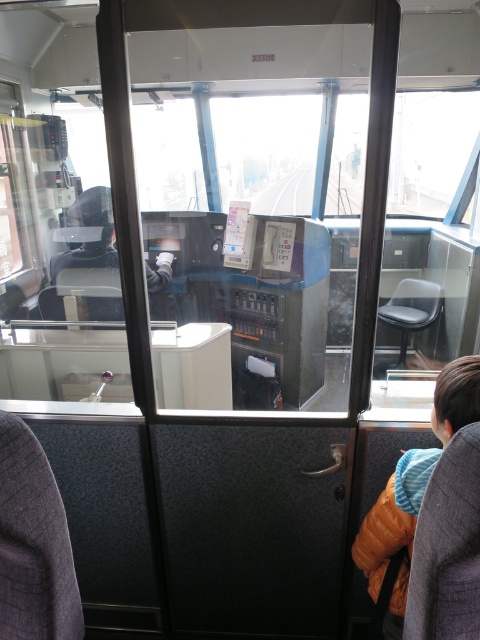
Between orange puffer jacket at lower right and dark gray hoodie at center, which one is positioned higher?

dark gray hoodie at center

The width and height of the screenshot is (480, 640). Find the location of `orange puffer jacket at lower right`. orange puffer jacket at lower right is located at coordinates [412, 492].